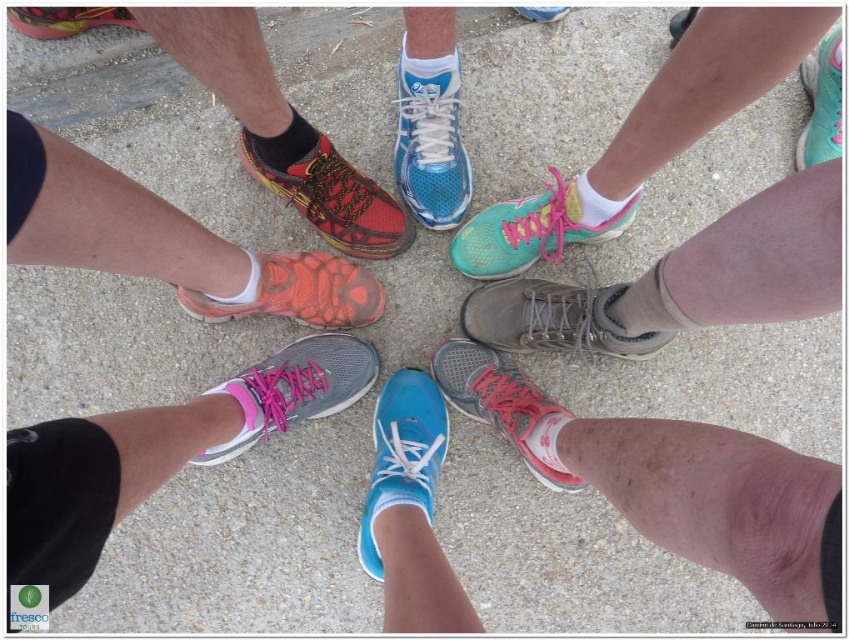
You are a photographer trying to capture a closeup of the matte orange shoe at center without the teal matte sneaker at upper right blocking it. Is there a way to adjust your position to achieve this?

The matte orange shoe at center is positioned under the teal matte sneaker at upper right. To avoid the sneaker blocking the view, you can lower your camera angle or move to a lower position to capture the matte orange shoe at center directly without obstruction.

You are a shoe designer observing the group of people in the circle. You notice two shiny red running shoes in the scene. Which one has a wider base? Please compare the shiny red running shoe at center and the shiny red running shoe at upper left.

The shiny red running shoe at center has a wider base than the shiny red running shoe at upper left.